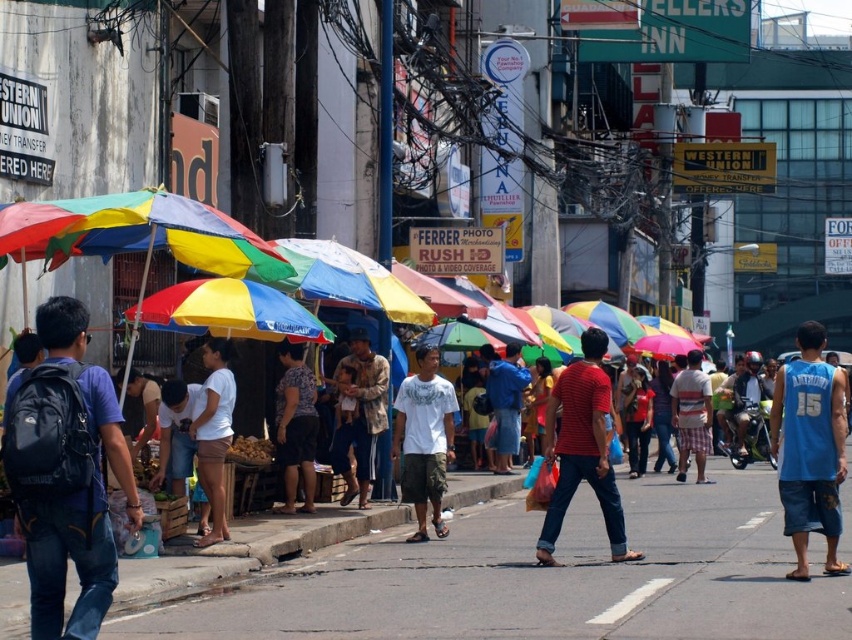
You are standing on the bustling street and want to take a photo of both the point at coordinates [672,556] and the point at [830,522]. Which point will appear closer to the camera in your photo?

Point [672,556] is further to the viewer than point [830,522], so in the photo, the point at [830,522] will appear closer to the camera.

You are a delivery person carrying a large package and need to navigate through the busy street scene. You see the gray asphalt at center and the blue denim pants at center. Which path should you choose to ensure your package won

The gray asphalt at center is wider than the blue denim pants at center, so choosing the path over the gray asphalt at center would provide more space for carrying your large package safely.

You are a tailor who needs to determine which shirt requires more fabric to make between the red striped shirt at center and the white cotton shirt at center. Based on the description provided, which shirt would need more fabric?

The red striped shirt at center requires more fabric because its width is larger than the white cotton shirt at center.